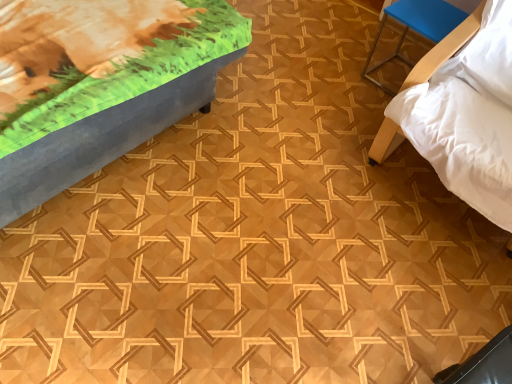
Find the location of a particular element. The image size is (512, 384). vacant location behind blue plastic stool at upper right, positioned as the 2th furniture in right-to-left order is located at coordinates (387, 46).